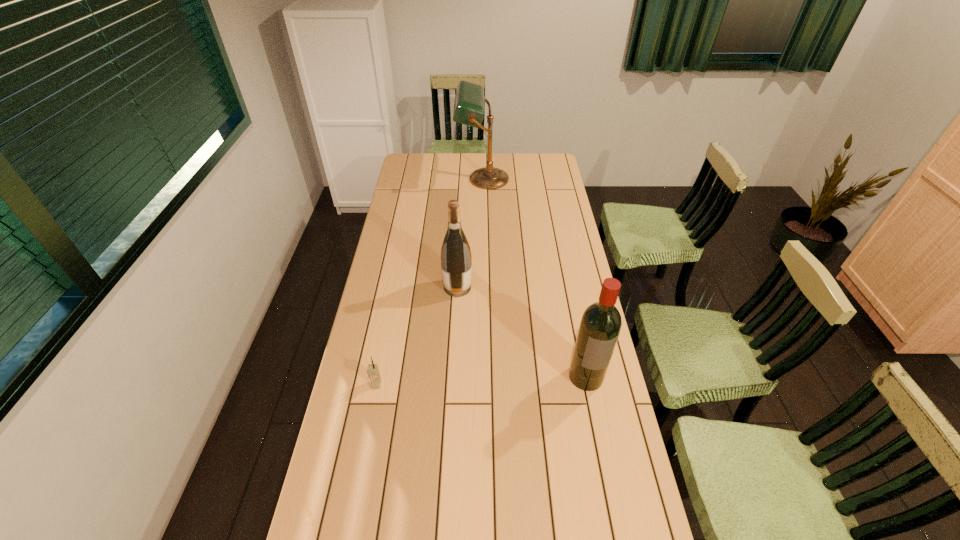
Locate an element on the screen. Image resolution: width=960 pixels, height=540 pixels. object identified as the third closest to the third nearest object is located at coordinates (469, 99).

At what (x,y) coordinates should I click in order to perform the action: click on the closest object to the cellular telephone. Please return your answer as a coordinate pair (x, y). This screenshot has height=540, width=960. Looking at the image, I should click on (456, 262).

You are a GUI agent. You are given a task and a screenshot of the screen. Output one action in this format:
    pyautogui.click(x=<x>, y=<y>)
    Task: Click on the free space that satisfies the following two spatial constraints: 1. above the green lampshade of the table lamp; 2. on the front of the leftmost object, where the keypad is located
    Image resolution: width=960 pixels, height=540 pixels.
    Given the screenshot: What is the action you would take?
    pyautogui.click(x=485, y=384)

Image resolution: width=960 pixels, height=540 pixels. I want to click on free space that satisfies the following two spatial constraints: 1. on the label of the second farthest object; 2. on the front of the leftmost object, where the keypad is located, so click(x=452, y=384).

Identify the location of blank space that satisfies the following two spatial constraints: 1. above the green lampshade of the table lamp; 2. on the front of the cellular telephone, where the keypad is located. (485, 384).

This screenshot has height=540, width=960. I want to click on vacant area that satisfies the following two spatial constraints: 1. on the label of the left wine bottle; 2. on the front of the leftmost object, where the keypad is located, so click(x=452, y=384).